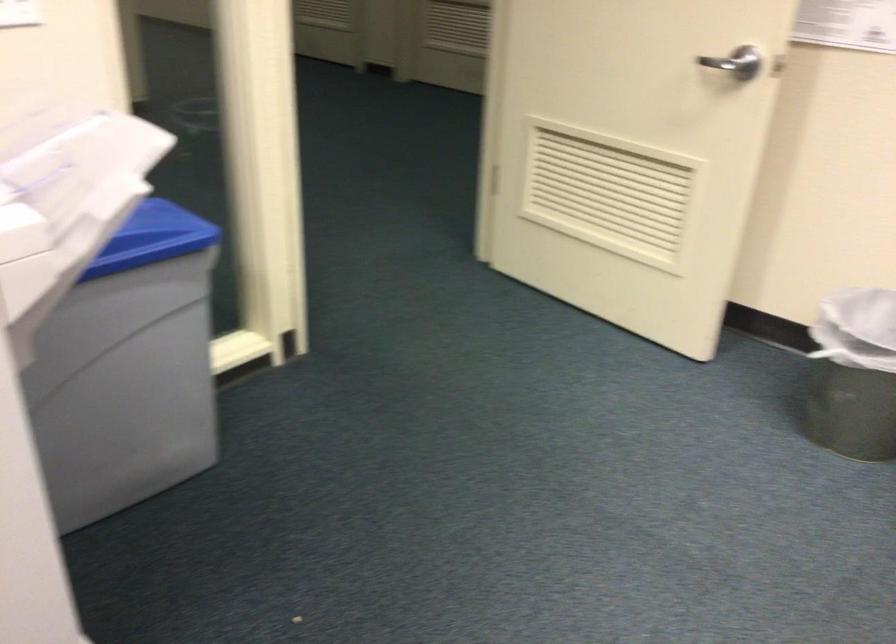
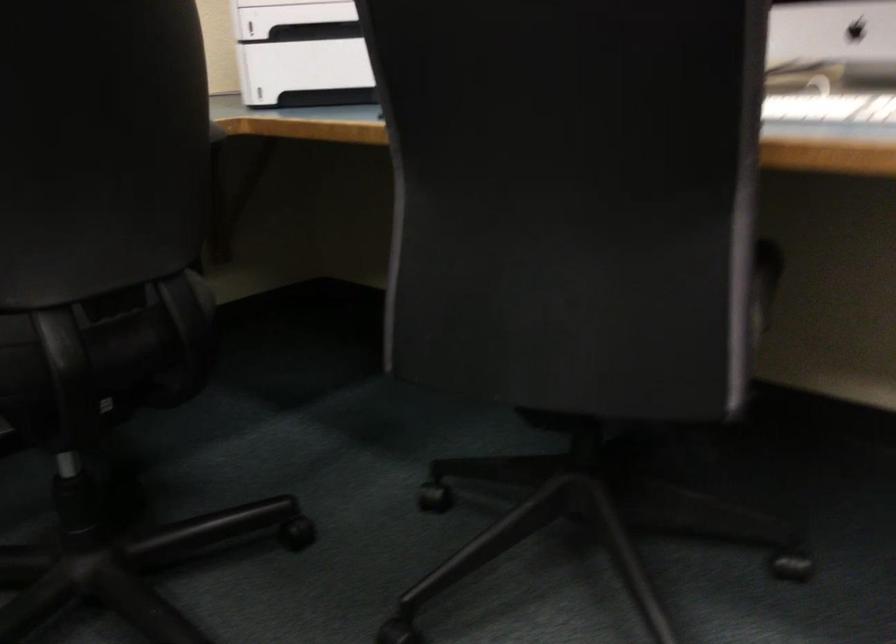
The images are taken continuously from a first-person perspective. In which direction is your viewpoint rotating?

The rotation direction of the camera is right-down.